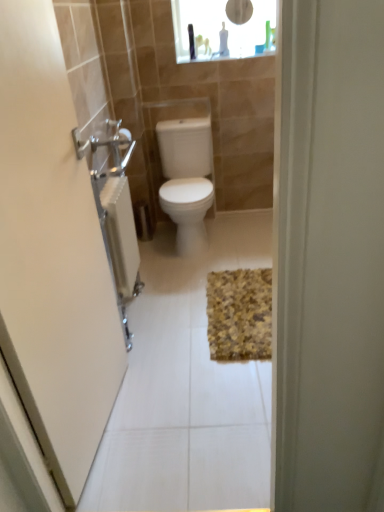
Question: Considering the relative sizes of yellow textured bath mat at center and white glossy toilet at center in the image provided, is yellow textured bath mat at center wider than white glossy toilet at center?

Choices:
 (A) yes
 (B) no

Answer: (A)

Question: From the image's perspective, does yellow textured bath mat at center appear lower than white glossy toilet at center?

Choices:
 (A) yes
 (B) no

Answer: (A)

Question: Does yellow textured bath mat at center lie behind white glossy toilet at center?

Choices:
 (A) no
 (B) yes

Answer: (A)

Question: Does yellow textured bath mat at center have a lesser height compared to white glossy toilet at center?

Choices:
 (A) no
 (B) yes

Answer: (B)

Question: Is yellow textured bath mat at center not within white glossy toilet at center?

Choices:
 (A) no
 (B) yes

Answer: (B)

Question: Is yellow textured bath mat at center taller than white glossy toilet at center?

Choices:
 (A) yes
 (B) no

Answer: (B)

Question: From the image's perspective, is transparent glass medicine cabinet at upper center beneath brushed metal towel rack at left?

Choices:
 (A) no
 (B) yes

Answer: (A)

Question: Is transparent glass medicine cabinet at upper center not within brushed metal towel rack at left?

Choices:
 (A) yes
 (B) no

Answer: (A)

Question: From a real-world perspective, is transparent glass medicine cabinet at upper center located beneath brushed metal towel rack at left?

Choices:
 (A) no
 (B) yes

Answer: (A)

Question: Can you confirm if transparent glass medicine cabinet at upper center is positioned to the left of brushed metal towel rack at left?

Choices:
 (A) no
 (B) yes

Answer: (A)

Question: Is transparent glass medicine cabinet at upper center taller than brushed metal towel rack at left?

Choices:
 (A) yes
 (B) no

Answer: (B)

Question: Is transparent glass medicine cabinet at upper center oriented towards brushed metal towel rack at left?

Choices:
 (A) no
 (B) yes

Answer: (B)

Question: Considering the relative sizes of yellow textured bath mat at center and transparent glass medicine cabinet at upper center in the image provided, is yellow textured bath mat at center smaller than transparent glass medicine cabinet at upper center?

Choices:
 (A) yes
 (B) no

Answer: (A)